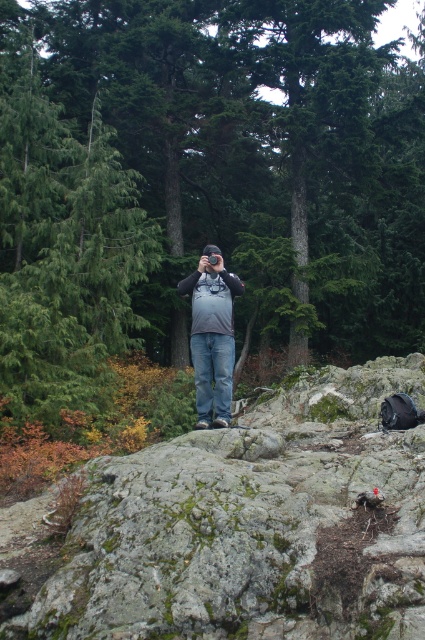
You are a hiker who wants to take a photo of the matte gray backpack at center without the green matte tree at center blocking the view. Should you move forward or backward from your current position?

The green matte tree at center is above the matte gray backpack at center. To avoid the tree blocking the backpack, you should move forward so the tree is no longer in front of the backpack.